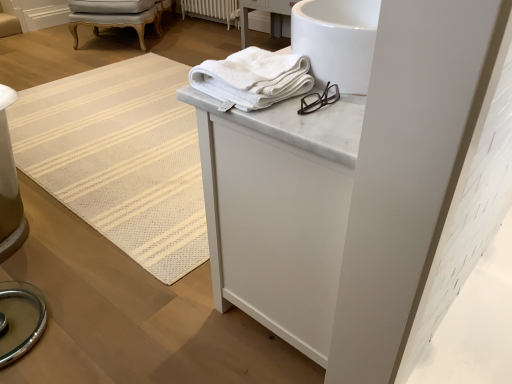
Question: Is white cotton towel at upper center placed right next to light gray upholstered chair at upper left?

Choices:
 (A) no
 (B) yes

Answer: (A)

Question: Can you confirm if white cotton towel at upper center is bigger than light gray upholstered chair at upper left?

Choices:
 (A) no
 (B) yes

Answer: (A)

Question: Is white cotton towel at upper center to the right of light gray upholstered chair at upper left from the viewer's perspective?

Choices:
 (A) yes
 (B) no

Answer: (A)

Question: Considering the relative sizes of white cotton towel at upper center and light gray upholstered chair at upper left in the image provided, is white cotton towel at upper center smaller than light gray upholstered chair at upper left?

Choices:
 (A) no
 (B) yes

Answer: (B)

Question: Considering the relative positions of white cotton towel at upper center and light gray upholstered chair at upper left in the image provided, is white cotton towel at upper center in front of light gray upholstered chair at upper left?

Choices:
 (A) yes
 (B) no

Answer: (A)

Question: From the image's perspective, is white cotton towel at upper center above light gray upholstered chair at upper left?

Choices:
 (A) no
 (B) yes

Answer: (A)

Question: From the image's perspective, is light gray upholstered chair at upper left below white painted radiator at center?

Choices:
 (A) no
 (B) yes

Answer: (B)

Question: Is light gray upholstered chair at upper left far from white painted radiator at center?

Choices:
 (A) yes
 (B) no

Answer: (B)

Question: From a real-world perspective, is light gray upholstered chair at upper left below white painted radiator at center?

Choices:
 (A) no
 (B) yes

Answer: (A)

Question: Does light gray upholstered chair at upper left have a smaller size compared to white painted radiator at center?

Choices:
 (A) no
 (B) yes

Answer: (A)

Question: Considering the relative sizes of light gray upholstered chair at upper left and white painted radiator at center in the image provided, is light gray upholstered chair at upper left bigger than white painted radiator at center?

Choices:
 (A) yes
 (B) no

Answer: (A)

Question: Is light gray upholstered chair at upper left directly adjacent to white painted radiator at center?

Choices:
 (A) no
 (B) yes

Answer: (A)

Question: Does white marble cabinet at upper center touch white painted radiator at center?

Choices:
 (A) no
 (B) yes

Answer: (A)